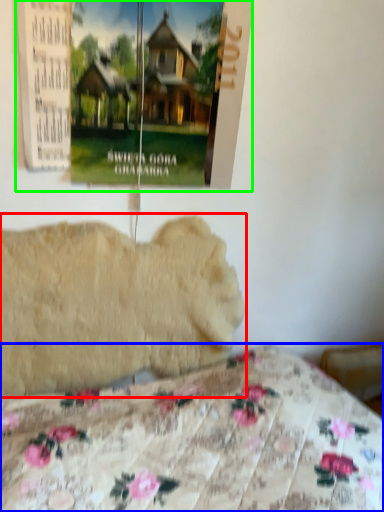
Question: Based on their relative distances, which object is farther from animal (highlighted by a red box)? Choose from bed (highlighted by a blue box) and poster page (highlighted by a green box).

Choices:
 (A) bed
 (B) poster page

Answer: (B)